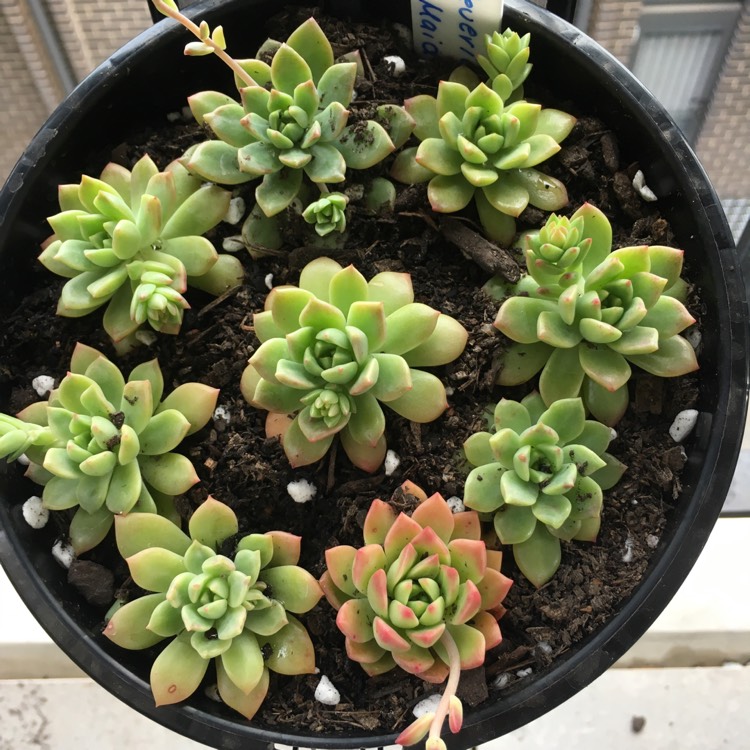
At what (x,y) coordinates should I click in order to perform the action: click on window. Please return your answer as a coordinate pair (x, y). This screenshot has width=750, height=750. Looking at the image, I should click on (668, 57).